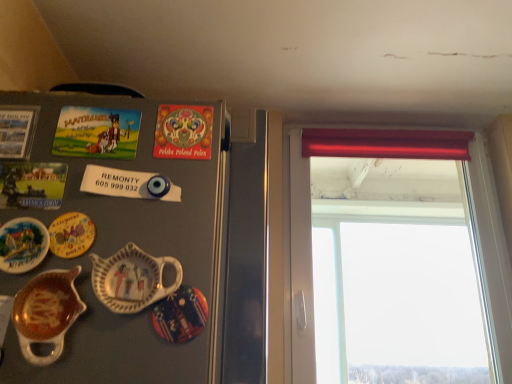
Question: Does matte ceramic plate at left, acting as the 2th plate starting from the right, appear on the left side of multicolored ceramic plate at center, positioned as the third plate in left-to-right order?

Choices:
 (A) yes
 (B) no

Answer: (A)

Question: Can you confirm if matte ceramic plate at left, acting as the 2th plate starting from the right, is smaller than multicolored ceramic plate at center, the 1th plate when ordered from right to left?

Choices:
 (A) no
 (B) yes

Answer: (B)

Question: Is matte ceramic plate at left, marked as the second plate in a left-to-right arrangement, looking in the opposite direction of multicolored ceramic plate at center, the 1th plate when ordered from right to left?

Choices:
 (A) yes
 (B) no

Answer: (B)

Question: Considering the relative sizes of matte ceramic plate at left, marked as the second plate in a left-to-right arrangement, and multicolored ceramic plate at center, positioned as the third plate in left-to-right order, in the image provided, is matte ceramic plate at left, marked as the second plate in a left-to-right arrangement, taller than multicolored ceramic plate at center, positioned as the third plate in left-to-right order,?

Choices:
 (A) no
 (B) yes

Answer: (A)

Question: From a real-world perspective, is matte ceramic plate at left, acting as the 2th plate starting from the right, located beneath multicolored ceramic plate at center, positioned as the third plate in left-to-right order?

Choices:
 (A) no
 (B) yes

Answer: (A)

Question: Is the depth of matte ceramic plate at left, acting as the 2th plate starting from the right, greater than that of multicolored ceramic plate at center, the 1th plate when ordered from right to left?

Choices:
 (A) no
 (B) yes

Answer: (B)

Question: From the image's perspective, does multicolored ceramic plate at center, the 1th plate when ordered from right to left, appear lower than red velvet curtain at upper center?

Choices:
 (A) yes
 (B) no

Answer: (A)

Question: Is multicolored ceramic plate at center, positioned as the third plate in left-to-right order, to the right of red velvet curtain at upper center from the viewer's perspective?

Choices:
 (A) no
 (B) yes

Answer: (A)

Question: Is multicolored ceramic plate at center, the 1th plate when ordered from right to left, surrounding red velvet curtain at upper center?

Choices:
 (A) no
 (B) yes

Answer: (A)

Question: Is multicolored ceramic plate at center, the 1th plate when ordered from right to left, thinner than red velvet curtain at upper center?

Choices:
 (A) no
 (B) yes

Answer: (B)

Question: Can you confirm if multicolored ceramic plate at center, the 1th plate when ordered from right to left, is shorter than red velvet curtain at upper center?

Choices:
 (A) yes
 (B) no

Answer: (A)

Question: Could you tell me if multicolored ceramic plate at center, positioned as the third plate in left-to-right order, is facing red velvet curtain at upper center?

Choices:
 (A) no
 (B) yes

Answer: (A)

Question: Is matte ceramic gravy boat at lower left, the second tableware when ordered from right to left, positioned with its back to decorative ceramic pitcher at left, which is the 1th tableware in right-to-left order?

Choices:
 (A) yes
 (B) no

Answer: (B)